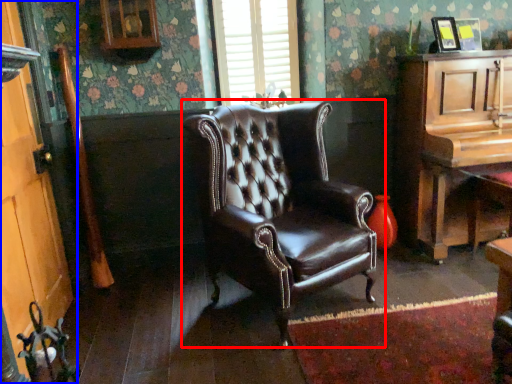
Question: Which point is closer to the camera, chair (highlighted by a red box) or door (highlighted by a blue box)?

Choices:
 (A) chair
 (B) door

Answer: (B)